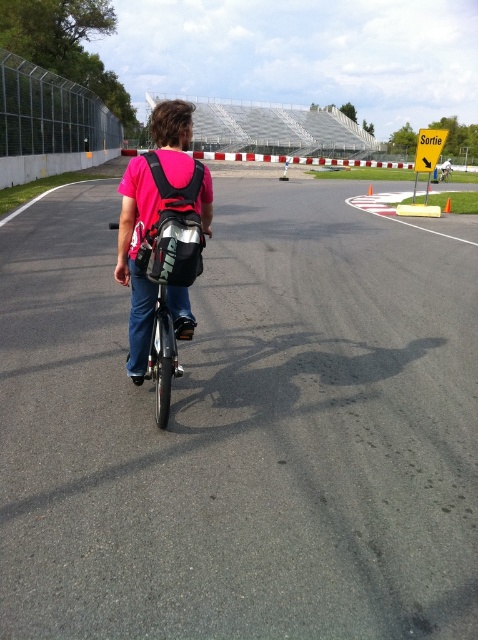
You are a photographer positioned at the starting line of the unicycle race. You want to capture a photo of the rider with both the black fabric backpack at center and the orange plastic cone at center in the frame. Which object will appear larger in your photo?

The black fabric backpack at center will appear larger in the photo because it is closer to the viewer than the orange plastic cone at center.

You are a safety inspector checking the unicycle race track. You notice the black fabric backpack at center and the orange plastic cone at center. Which object takes up more space on the track?

The black fabric backpack at center has a larger size compared to the orange plastic cone at center, so the backpack takes up more space on the track.

You are standing at the point marked as point (80, 387). You want to watch a unicycle race happening on the track ahead. The safety barriers are 5 meters away from your current position. Can you safely observe the race without crossing the barriers?

The distance between you and the point is 4.36 meters, which is less than the 5 meters to the barriers. Therefore, you can safely observe the race without crossing the barriers.